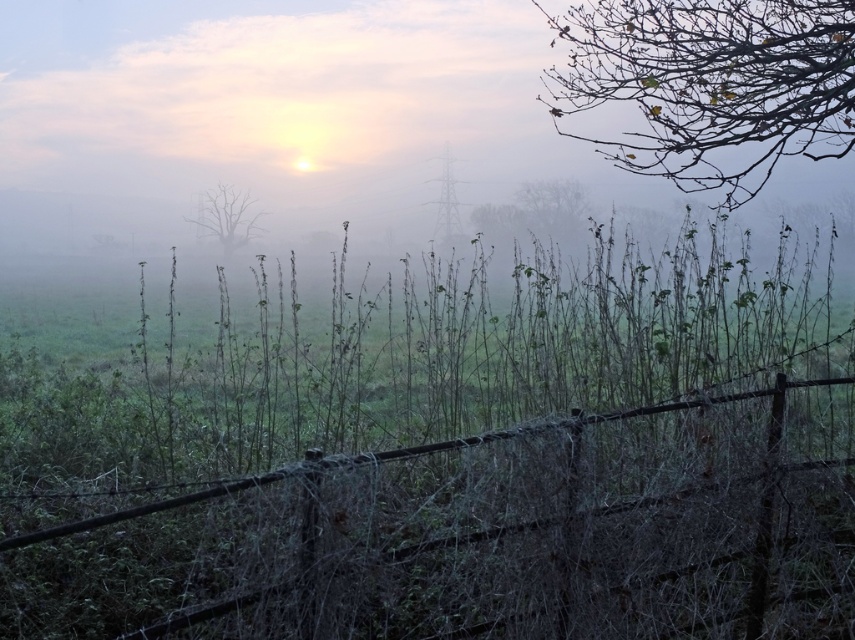
From the picture: You are a painter setting up your easel in the field. You want to paint the rusty wire fence at center and the brown leafy branches at upper right. Which object will you need to tilt your head upwards more to view properly?

The brown leafy branches at upper right are taller than the rusty wire fence at center, so you will need to tilt your head upwards more to view the brown leafy branches at upper right properly.

You are standing in the rural landscape and want to determine which of the two points, point (736, 22) or point (220, 240), is nearer to you. Based on the scene description, which point is closer?

Point (736, 22) is closer to the camera than point (220, 240), so it is the nearer one.